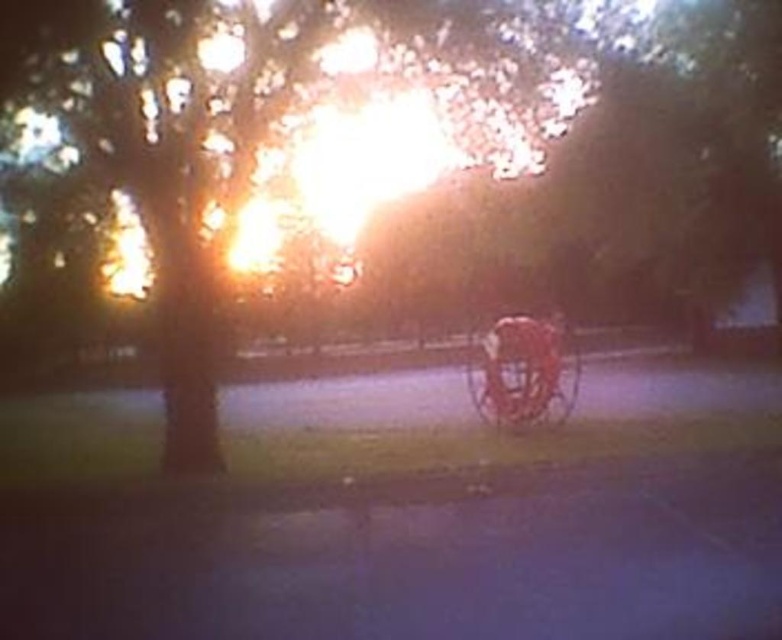
Question: Which point is closer to the camera?

Choices:
 (A) (540, 344)
 (B) (361, 4)

Answer: (B)

Question: Does green matte tree at center appear on the left side of metallic gold horse cart at center?

Choices:
 (A) yes
 (B) no

Answer: (A)

Question: Which object appears closest to the camera in this image?

Choices:
 (A) green matte tree at center
 (B) metallic gold horse cart at center

Answer: (A)

Question: Can you confirm if green matte tree at center is positioned to the left of metallic gold horse cart at center?

Choices:
 (A) yes
 (B) no

Answer: (A)

Question: Does green matte tree at center lie in front of metallic gold horse cart at center?

Choices:
 (A) yes
 (B) no

Answer: (A)